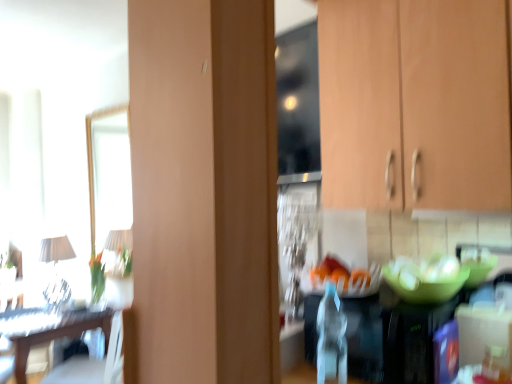
Identify the location of clear plastic bottle at center. This screenshot has width=512, height=384. (364, 337).

Measure the distance between point (x=20, y=354) and camera.

7.89 feet.

What do you see at coordinates (415, 103) in the screenshot?
I see `wooden cabinet at upper right` at bounding box center [415, 103].

Locate an element on the screen. This screenshot has height=384, width=512. green matte glass bowl at center is located at coordinates (426, 288).

Would you say white fabric lampshade at left is to the left or to the right of wooden cabinet at upper right in the picture?

In the image, white fabric lampshade at left appears on the left side of wooden cabinet at upper right.

Could you tell me if white fabric lampshade at left is facing wooden cabinet at upper right?

No, white fabric lampshade at left is not aimed at wooden cabinet at upper right.

Considering the points (72, 255) and (335, 115), which point is in front, point (72, 255) or point (335, 115)?

The point (335, 115) is more forward.

Does clear plastic bottle at center touch green matte glass bowl at center?

→ clear plastic bottle at center and green matte glass bowl at center are not in contact.

Is clear plastic bottle at center oriented towards green matte glass bowl at center?

No, clear plastic bottle at center is not facing towards green matte glass bowl at center.

Which is behind, point (313, 337) or point (422, 282)?

Positioned behind is point (313, 337).

Find the location of a particular element. The width and height of the screenshot is (512, 384). glass bowl on the right side of clear plastic bottle at center is located at coordinates (426, 288).

Does clear plastic bottle at center appear on the left side of wooden cabinet at upper right?

Indeed, clear plastic bottle at center is positioned on the left side of wooden cabinet at upper right.

Is clear plastic bottle at center in front of or behind wooden cabinet at upper right in the image?

In the image, clear plastic bottle at center appears behind wooden cabinet at upper right.

Measure the distance between clear plastic bottle at center and wooden cabinet at upper right.

clear plastic bottle at center and wooden cabinet at upper right are 23.45 inches apart from each other.

Can you confirm if clear plastic bottle at center is bigger than wooden cabinet at upper right?

Actually, clear plastic bottle at center might be smaller than wooden cabinet at upper right.

From a real-world perspective, does green matte glass bowl at center sit lower than clear plastic bottle at center?

No, from a real-world perspective, green matte glass bowl at center is not under clear plastic bottle at center.

Can you confirm if green matte glass bowl at center is thinner than clear plastic bottle at center?

Incorrect, the width of green matte glass bowl at center is not less than that of clear plastic bottle at center.

Is green matte glass bowl at center bigger than clear plastic bottle at center?

Yes, green matte glass bowl at center is bigger than clear plastic bottle at center.

Is green matte glass bowl at center taller or shorter than clear plastic bottle at center?

Considering their sizes, green matte glass bowl at center has less height than clear plastic bottle at center.

Locate an element on the screen. This screenshot has height=384, width=512. lamp beneath the clear plastic bottle at center (from a real-world perspective) is located at coordinates (56, 268).

From the picture: Does clear plastic bottle at center touch white fabric lampshade at left?

No, clear plastic bottle at center is not beside white fabric lampshade at left.

Is clear plastic bottle at center looking in the opposite direction of white fabric lampshade at left?

Yes.

Can you tell me how much clear plastic bottle at center and white fabric lampshade at left differ in facing direction?

There is a 91-degree angle between the facing directions of clear plastic bottle at center and white fabric lampshade at left.

Could you tell me if white fabric lampshade at left is turned towards green matte glass bowl at center?

No, white fabric lampshade at left is not facing towards green matte glass bowl at center.

From the image's perspective, is white fabric lampshade at left located beneath green matte glass bowl at center?

Yes, from the image's perspective, white fabric lampshade at left is below green matte glass bowl at center.

Which of these two, white fabric lampshade at left or green matte glass bowl at center, is wider?

white fabric lampshade at left.

Considering the sizes of objects white fabric lampshade at left and clear plastic bottle at center in the image provided, who is smaller, white fabric lampshade at left or clear plastic bottle at center?

Smaller between the two is clear plastic bottle at center.

Which is nearer, (54, 252) or (304, 341)?

The point (304, 341) is in front.

Does white fabric lampshade at left appear on the left side of clear plastic bottle at center?

Indeed, white fabric lampshade at left is positioned on the left side of clear plastic bottle at center.

Based on the photo, relative to clear plastic bottle at center, is white fabric lampshade at left in front or behind?

Answer: white fabric lampshade at left is behind clear plastic bottle at center.

In the image, there is a wooden cabinet at upper right. At what (x,y) coordinates should I click in order to perform the action: click on lamp below it (from a real-world perspective). Please return your answer as a coordinate pair (x, y). The height and width of the screenshot is (384, 512). Looking at the image, I should click on (56, 268).

You are a GUI agent. You are given a task and a screenshot of the screen. Output one action in this format:
    pyautogui.click(x=<x>, y=<y>)
    Task: Click on the glass bowl above the clear plastic bottle at center (from a real-world perspective)
    This screenshot has width=512, height=384.
    Given the screenshot: What is the action you would take?
    pyautogui.click(x=426, y=288)

Considering their positions, is green matte glass bowl at center positioned further to clear plastic bottle at center than wooden cabinet at upper right?

Based on the image, wooden cabinet at upper right appears to be further to clear plastic bottle at center.

Based on their spatial positions, is clear plastic bottle at center or wooden cabinet at upper right closer to wooden table at left?

Based on the image, clear plastic bottle at center appears to be nearer to wooden table at left.

Looking at the image, which one is located further to clear plastic bottle at center, wooden cabinet at upper right or wooden table at left?

Among the two, wooden table at left is located further to clear plastic bottle at center.

Considering their positions, is white fabric lampshade at left positioned closer to wooden table at left than clear plastic bottle at center?

Among the two, white fabric lampshade at left is located nearer to wooden table at left.

Considering their positions, is white fabric lampshade at left positioned further to clear plastic bottle at center than green matte glass bowl at center?

Based on the image, white fabric lampshade at left appears to be further to clear plastic bottle at center.

Which object lies further to the anchor point wooden cabinet at upper right, clear plastic bottle at center or green matte glass bowl at center?

Based on the image, clear plastic bottle at center appears to be further to wooden cabinet at upper right.

Looking at the image, which one is located closer to green matte glass bowl at center, wooden cabinet at upper right or wooden table at left?

Based on the image, wooden cabinet at upper right appears to be nearer to green matte glass bowl at center.

When comparing their distances from green matte glass bowl at center, does clear plastic bottle at center or white fabric lampshade at left seem further?

white fabric lampshade at left is positioned further to the anchor green matte glass bowl at center.

Find the location of a particular element. This screenshot has width=512, height=384. table located between white fabric lampshade at left and green matte glass bowl at center in the left-right direction is located at coordinates (58, 335).

The width and height of the screenshot is (512, 384). Find the location of `table between white fabric lampshade at left and wooden cabinet at upper right from left to right`. table between white fabric lampshade at left and wooden cabinet at upper right from left to right is located at coordinates (58, 335).

You are a GUI agent. You are given a task and a screenshot of the screen. Output one action in this format:
    pyautogui.click(x=<x>, y=<y>)
    Task: Click on the cabinetry between wooden table at left and green matte glass bowl at center
    The width and height of the screenshot is (512, 384).
    Given the screenshot: What is the action you would take?
    pyautogui.click(x=415, y=103)

The width and height of the screenshot is (512, 384). Find the location of `appliance between wooden table at left and wooden cabinet at upper right from left to right`. appliance between wooden table at left and wooden cabinet at upper right from left to right is located at coordinates (364, 337).